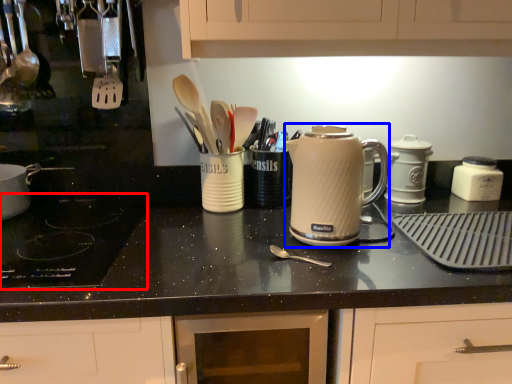
Question: Which of the following is the farthest to the observer, gas stove (highlighted by a red box) or kitchen appliance (highlighted by a blue box)?

Choices:
 (A) gas stove
 (B) kitchen appliance

Answer: (B)